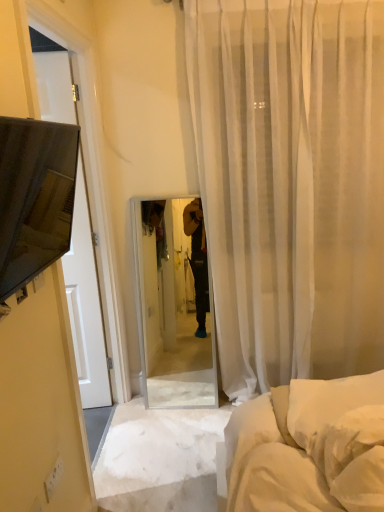
Locate an element on the screen. This screenshot has height=512, width=384. matte black tv at left is located at coordinates (34, 197).

The image size is (384, 512). I want to click on white soft pillow at lower right, so click(328, 402).

Which of these two, white soft pillow at lower right or sheer white curtain at center, is smaller?

Smaller between the two is white soft pillow at lower right.

Is white soft pillow at lower right spatially inside sheer white curtain at center, or outside of it?

white soft pillow at lower right exists outside the volume of sheer white curtain at center.

From a real-world perspective, is white soft pillow at lower right over sheer white curtain at center?

Actually, white soft pillow at lower right is physically below sheer white curtain at center in the real world.

Considering the sizes of objects white soft pillow at lower right and sheer white curtain at center in the image provided, who is wider, white soft pillow at lower right or sheer white curtain at center?

white soft pillow at lower right is wider.

From the picture: Which of these two, sheer white curtain at center or white soft pillow at lower right, is thinner?

Thinner between the two is sheer white curtain at center.

Considering their positions, is sheer white curtain at center located in front of or behind white soft pillow at lower right?

In the image, sheer white curtain at center appears behind white soft pillow at lower right.

Is sheer white curtain at center far from white soft pillow at lower right?

sheer white curtain at center is far away from white soft pillow at lower right.

Between sheer white curtain at center and white soft pillow at lower right, which one has larger size?

With larger size is sheer white curtain at center.

Considering the relative sizes of white soft pillow at lower right and matte black tv at left in the image provided, is white soft pillow at lower right taller than matte black tv at left?

In fact, white soft pillow at lower right may be shorter than matte black tv at left.

From a real-world perspective, who is located higher, white soft pillow at lower right or matte black tv at left?

From a 3D spatial view, matte black tv at left is above.

In the scene shown: Is white soft pillow at lower right oriented away from matte black tv at left?

No, white soft pillow at lower right is not facing the opposite direction of matte black tv at left.

Considering their positions, is white soft pillow at lower right located in front of or behind matte black tv at left?

In the image, white soft pillow at lower right appears behind matte black tv at left.

Is matte black tv at left facing away from sheer white curtain at center?

No, matte black tv at left is not facing away from sheer white curtain at center.

From a real-world perspective, is matte black tv at left physically located above or below sheer white curtain at center?

In terms of real-world spatial position, matte black tv at left is above sheer white curtain at center.

Which of these two, matte black tv at left or sheer white curtain at center, stands taller?

sheer white curtain at center is taller.

Is matte black tv at left oriented towards white soft pillow at lower right?

No, matte black tv at left is not turned towards white soft pillow at lower right.

From a real-world perspective, is matte black tv at left physically located above or below white soft pillow at lower right?

From a real-world perspective, matte black tv at left is physically above white soft pillow at lower right.

Does matte black tv at left have a lesser height compared to white soft pillow at lower right?

In fact, matte black tv at left may be taller than white soft pillow at lower right.

Which object is closer to the camera, matte black tv at left or white soft pillow at lower right?

matte black tv at left.

Between sheer white curtain at center and matte black tv at left, which one has smaller size?

Smaller between the two is matte black tv at left.

Is sheer white curtain at center taller than matte black tv at left?

Yes.

Is sheer white curtain at center situated inside matte black tv at left or outside?

sheer white curtain at center is not enclosed by matte black tv at left.

Identify the location of curtain located above the white soft pillow at lower right (from the image's perspective). The width and height of the screenshot is (384, 512). (291, 183).

Locate an element on the screen. This screenshot has width=384, height=512. curtain located behind the white soft pillow at lower right is located at coordinates (291, 183).

Looking at the image, which one is located closer to white soft pillow at lower right, sheer white curtain at center or matte black tv at left?

matte black tv at left lies closer to white soft pillow at lower right than the other object.

Looking at the image, which one is located closer to sheer white curtain at center, white soft pillow at lower right or matte black tv at left?

white soft pillow at lower right.

Looking at this image, estimate the real-world distances between objects in this image. Which object is closer to matte black tv at left, sheer white curtain at center or white soft pillow at lower right?

Among the two, white soft pillow at lower right is located nearer to matte black tv at left.

Which object lies nearer to the anchor point matte black tv at left, white soft pillow at lower right or sheer white curtain at center?

white soft pillow at lower right.

When comparing their distances from sheer white curtain at center, does matte black tv at left or white soft pillow at lower right seem further?

Based on the image, matte black tv at left appears to be further to sheer white curtain at center.

Which object lies nearer to the anchor point white soft pillow at lower right, matte black tv at left or sheer white curtain at center?

matte black tv at left lies closer to white soft pillow at lower right than the other object.

Image resolution: width=384 pixels, height=512 pixels. Find the location of `pillow situated between matte black tv at left and sheer white curtain at center from left to right`. pillow situated between matte black tv at left and sheer white curtain at center from left to right is located at coordinates (328, 402).